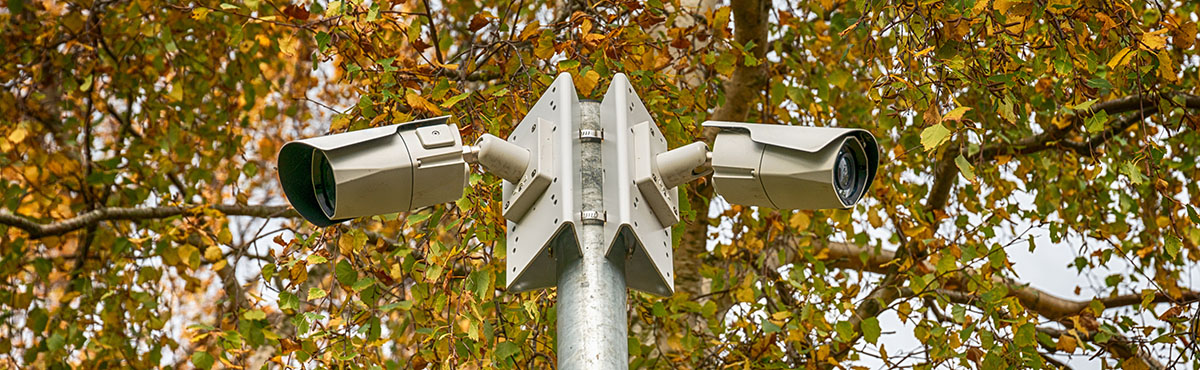
Locate an element on the screen. Image resolution: width=1200 pixels, height=370 pixels. frame is located at coordinates (557, 135).